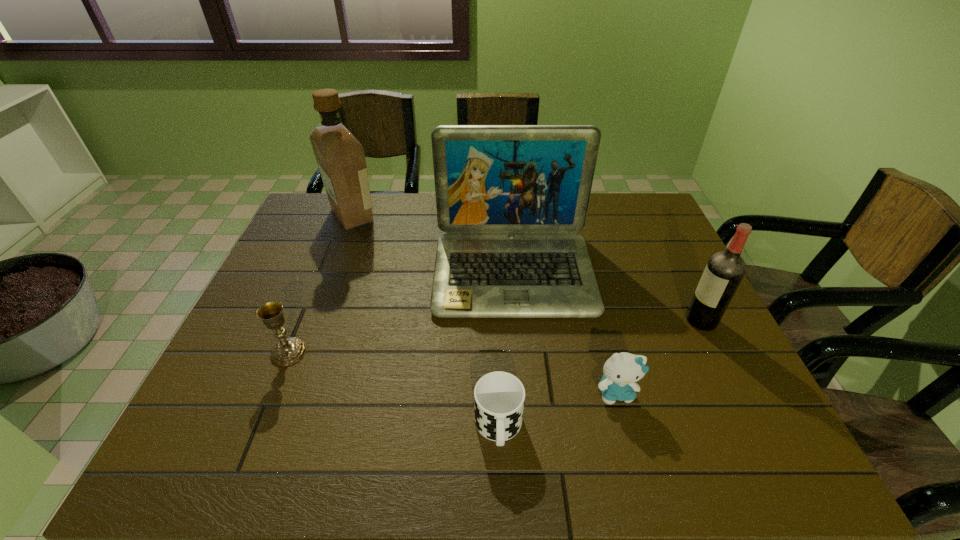
You are a GUI agent. You are given a task and a screenshot of the screen. Output one action in this format:
    pyautogui.click(x=<x>, y=<y>)
    Task: Click on the vacant area that lies between the cup and the third shortest object
    This screenshot has width=960, height=540.
    Given the screenshot: What is the action you would take?
    pyautogui.click(x=394, y=390)

Find the location of `free point between the fourth tallest object and the shortest object`. free point between the fourth tallest object and the shortest object is located at coordinates (394, 390).

Find the location of a particular element. This screenshot has width=960, height=540. free space that is in between the left liquor and the cup is located at coordinates (425, 321).

Where is `free spot between the cup and the third shortest object`? The height and width of the screenshot is (540, 960). free spot between the cup and the third shortest object is located at coordinates (394, 390).

Locate an element on the screen. This screenshot has width=960, height=540. free area in between the fourth tallest object and the nearer liquor is located at coordinates (495, 336).

You are a GUI agent. You are given a task and a screenshot of the screen. Output one action in this format:
    pyautogui.click(x=<x>, y=<y>)
    Task: Click on the free spot between the laptop computer and the taller liquor
    The height and width of the screenshot is (540, 960).
    Given the screenshot: What is the action you would take?
    pyautogui.click(x=433, y=244)

The width and height of the screenshot is (960, 540). What are the coordinates of `object that is the nearest to the fourth shortest object` in the screenshot? It's located at (510, 198).

I want to click on object that is the closest to the shorter liquor, so [x=510, y=198].